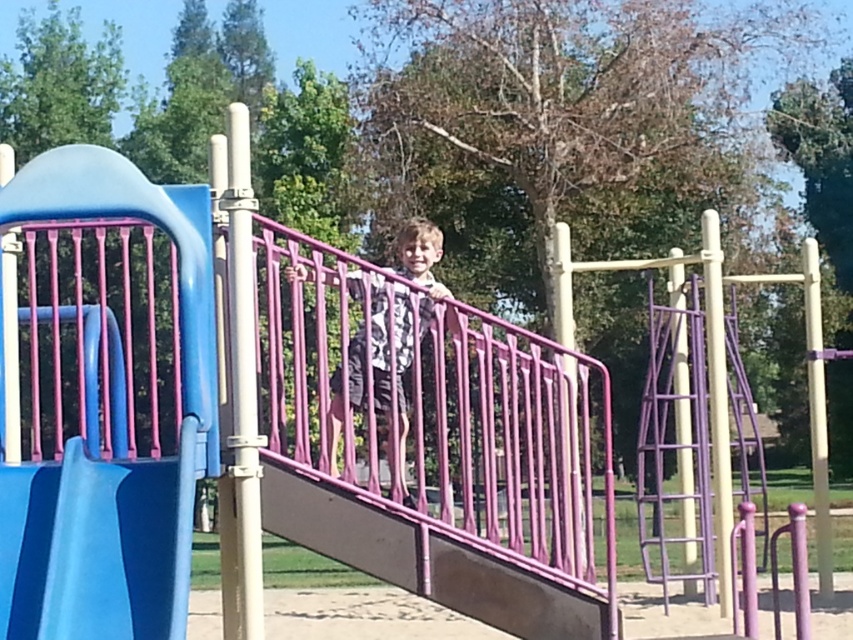
You are a parent trying to decide which part of the playground equipment is larger. You see the smooth plastic slide at left and the matte pink railing at center. Which one is larger?

The smooth plastic slide at left is bigger than the matte pink railing at center according to the description.

You are a parent trying to decide which play equipment is safer for your child to climb. The smooth plastic slide at left and the matte pink railing at center are both options. Based on their height, which one would be more appropriate for a child who is 1.2 meters tall?

The matte pink railing at center is shorter than the smooth plastic slide at left. Since the child is 1.2 meters tall, the railing might be a safer option as it is lower to the ground and easier for the child to manage.

Where is the smooth plastic slide at left located in the playground scene?

The smooth plastic slide at left is located at point (x=96, y=545) in the playground scene.